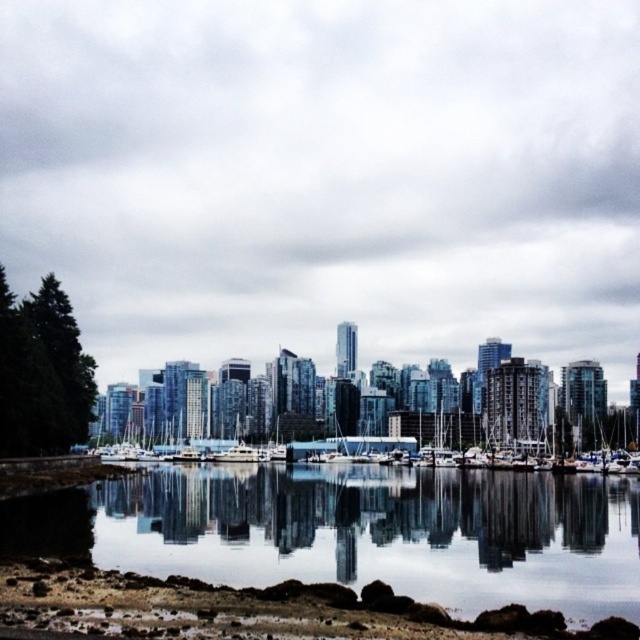
Question: Does clear water at lower left have a larger size compared to white glossy boats at center?

Choices:
 (A) yes
 (B) no

Answer: (B)

Question: Is transparent glass skyscrapers at center thinner than bare soil at lower center?

Choices:
 (A) no
 (B) yes

Answer: (A)

Question: Which point appears closest to the camera in this image?

Choices:
 (A) (632, 552)
 (B) (209, 452)
 (C) (180, 598)
 (D) (490, 333)

Answer: (C)

Question: Which of the following is the farthest from the observer?

Choices:
 (A) (339, 540)
 (B) (200, 285)
 (C) (204, 611)
 (D) (429, 422)

Answer: (B)

Question: Is transparent glass skyscrapers at center below clear water at lower left?

Choices:
 (A) yes
 (B) no

Answer: (B)

Question: Which object appears farthest from the camera in this image?

Choices:
 (A) bare soil at lower center
 (B) clear water at lower left
 (C) transparent glass skyscrapers at center
 (D) white glossy boats at center

Answer: (D)